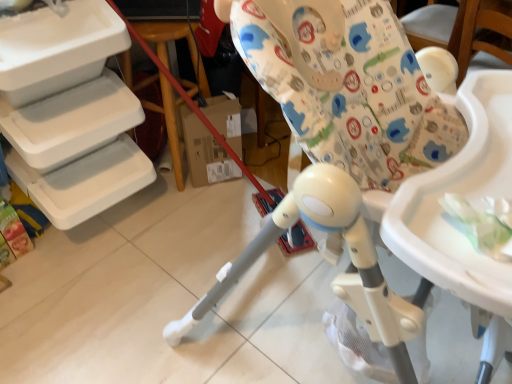
Question: Is white plastic highchair at center bigger or smaller than wooden at left?

Choices:
 (A) big
 (B) small

Answer: (A)

Question: Is white plastic highchair at center situated inside wooden at left or outside?

Choices:
 (A) outside
 (B) inside

Answer: (A)

Question: From a real-world perspective, relative to wooden at left, is white plastic highchair at center vertically above or below?

Choices:
 (A) above
 (B) below

Answer: (A)

Question: Choose the correct answer: Is wooden at left inside white plastic highchair at center or outside it?

Choices:
 (A) inside
 (B) outside

Answer: (B)

Question: In terms of size, does wooden at left appear bigger or smaller than white plastic highchair at center?

Choices:
 (A) small
 (B) big

Answer: (A)

Question: Is wooden at left in front of or behind white plastic highchair at center in the image?

Choices:
 (A) front
 (B) behind

Answer: (B)

Question: From a real-world perspective, is wooden at left above or below white plastic highchair at center?

Choices:
 (A) below
 (B) above

Answer: (A)